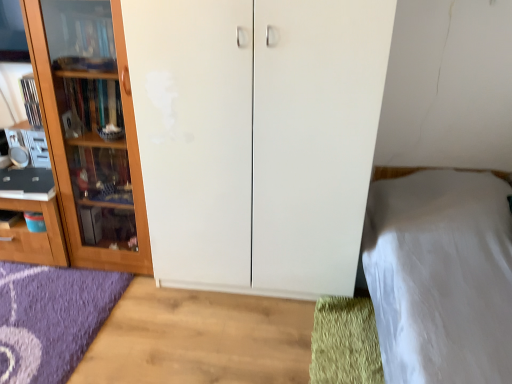
Question: Does white smooth bed at right have a greater height compared to wooden cabinet at left, the second cupboard when ordered from right to left?

Choices:
 (A) yes
 (B) no

Answer: (B)

Question: From a real-world perspective, is white smooth bed at right below wooden cabinet at left, the 1th cupboard viewed from the left?

Choices:
 (A) no
 (B) yes

Answer: (B)

Question: Is wooden cabinet at left, the 1th cupboard viewed from the left, surrounded by white smooth bed at right?

Choices:
 (A) yes
 (B) no

Answer: (B)

Question: From the image's perspective, does white smooth bed at right appear higher than wooden cabinet at left, the 1th cupboard viewed from the left?

Choices:
 (A) no
 (B) yes

Answer: (A)

Question: Can you confirm if white smooth bed at right is positioned to the left of wooden cabinet at left, the 1th cupboard viewed from the left?

Choices:
 (A) no
 (B) yes

Answer: (A)

Question: From the image's perspective, relative to wooden cabinet at left, the second cupboard when ordered from right to left, is green shaggy doormat at lower right above or below?

Choices:
 (A) below
 (B) above

Answer: (A)

Question: Is green shaggy doormat at lower right inside or outside of wooden cabinet at left, the second cupboard when ordered from right to left?

Choices:
 (A) inside
 (B) outside

Answer: (B)

Question: Is green shaggy doormat at lower right in front of or behind wooden cabinet at left, the second cupboard when ordered from right to left, in the image?

Choices:
 (A) front
 (B) behind

Answer: (A)

Question: From a real-world perspective, is green shaggy doormat at lower right above or below wooden cabinet at left, the second cupboard when ordered from right to left?

Choices:
 (A) below
 (B) above

Answer: (A)

Question: In terms of width, does white matte cupboard at center, acting as the 1th cupboard starting from the right, look wider or thinner when compared to wooden cabinet at left, the 1th cupboard viewed from the left?

Choices:
 (A) thin
 (B) wide

Answer: (B)

Question: Is point (150, 231) closer or farther from the camera than point (137, 157)?

Choices:
 (A) farther
 (B) closer

Answer: (A)

Question: Is white matte cupboard at center, the second cupboard positioned from the left, taller or shorter than wooden cabinet at left, the 1th cupboard viewed from the left?

Choices:
 (A) short
 (B) tall

Answer: (B)

Question: Relative to wooden cabinet at left, the 1th cupboard viewed from the left, is white matte cupboard at center, the second cupboard positioned from the left, in front or behind?

Choices:
 (A) behind
 (B) front

Answer: (B)

Question: Visually, is wooden cabinet at left, the second cupboard when ordered from right to left, positioned to the left or to the right of white matte cupboard at center, the second cupboard positioned from the left?

Choices:
 (A) left
 (B) right

Answer: (A)

Question: From the image's perspective, is wooden cabinet at left, the 1th cupboard viewed from the left, located above or below white matte cupboard at center, the second cupboard positioned from the left?

Choices:
 (A) above
 (B) below

Answer: (A)